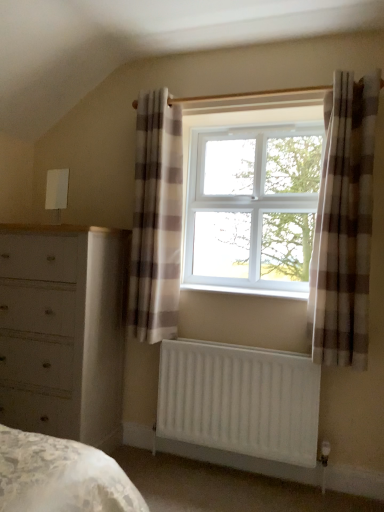
Question: Is plaid fabric curtain at center, the first curtain in the left-to-right sequence, positioned far away from white matte radiator at lower center?

Choices:
 (A) no
 (B) yes

Answer: (A)

Question: From the image's perspective, is plaid fabric curtain at center, the first curtain in the left-to-right sequence, beneath white matte radiator at lower center?

Choices:
 (A) yes
 (B) no

Answer: (B)

Question: From a real-world perspective, is plaid fabric curtain at center, the first curtain in the left-to-right sequence, on top of white matte radiator at lower center?

Choices:
 (A) no
 (B) yes

Answer: (B)

Question: Is plaid fabric curtain at center, the first curtain in the left-to-right sequence, bigger than white matte radiator at lower center?

Choices:
 (A) yes
 (B) no

Answer: (A)

Question: From a real-world perspective, does plaid fabric curtain at center, which appears as the first curtain when viewed from the back, sit lower than white matte radiator at lower center?

Choices:
 (A) yes
 (B) no

Answer: (B)

Question: From the image's perspective, is white plastic window sill at center positioned above or below plaid fabric curtain at center, which appears as the first curtain when viewed from the back?

Choices:
 (A) below
 (B) above

Answer: (A)

Question: Is white plastic window sill at center bigger or smaller than plaid fabric curtain at center, which ranks as the 2th curtain in right-to-left order?

Choices:
 (A) big
 (B) small

Answer: (B)

Question: Is white plastic window sill at center wider or thinner than plaid fabric curtain at center, the first curtain in the left-to-right sequence?

Choices:
 (A) wide
 (B) thin

Answer: (A)

Question: Considering the relative positions of white plastic window sill at center and plaid fabric curtain at center, which ranks as the 2th curtain in right-to-left order, in the image provided, is white plastic window sill at center to the left or to the right of plaid fabric curtain at center, which ranks as the 2th curtain in right-to-left order,?

Choices:
 (A) right
 (B) left

Answer: (A)

Question: From the image's perspective, is brown checkered curtain at right, placed as the second curtain when sorted from left to right, located above or below white plastic window at center?

Choices:
 (A) below
 (B) above

Answer: (A)

Question: In terms of height, does brown checkered curtain at right, placed as the second curtain when sorted from left to right, look taller or shorter compared to white plastic window at center?

Choices:
 (A) tall
 (B) short

Answer: (A)

Question: Would you say brown checkered curtain at right, which is counted as the second curtain, starting from the back, is inside or outside white plastic window at center?

Choices:
 (A) outside
 (B) inside

Answer: (A)

Question: Considering the positions of point (331, 98) and point (292, 168), is point (331, 98) closer or farther from the camera than point (292, 168)?

Choices:
 (A) closer
 (B) farther

Answer: (A)

Question: From a real-world perspective, is white matte radiator at lower center above or below white plastic window sill at center?

Choices:
 (A) below
 (B) above

Answer: (A)

Question: Based on their sizes in the image, would you say white matte radiator at lower center is bigger or smaller than white plastic window sill at center?

Choices:
 (A) small
 (B) big

Answer: (B)